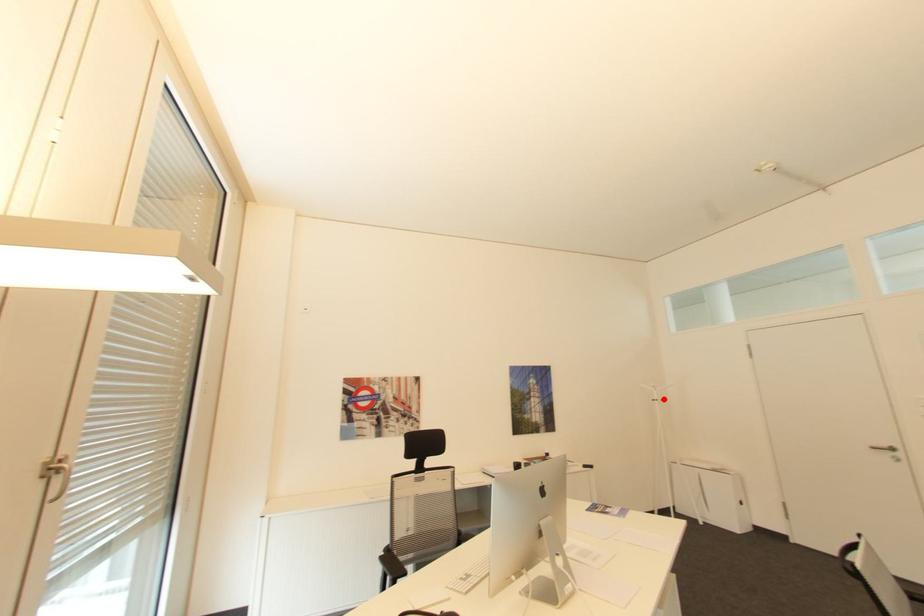
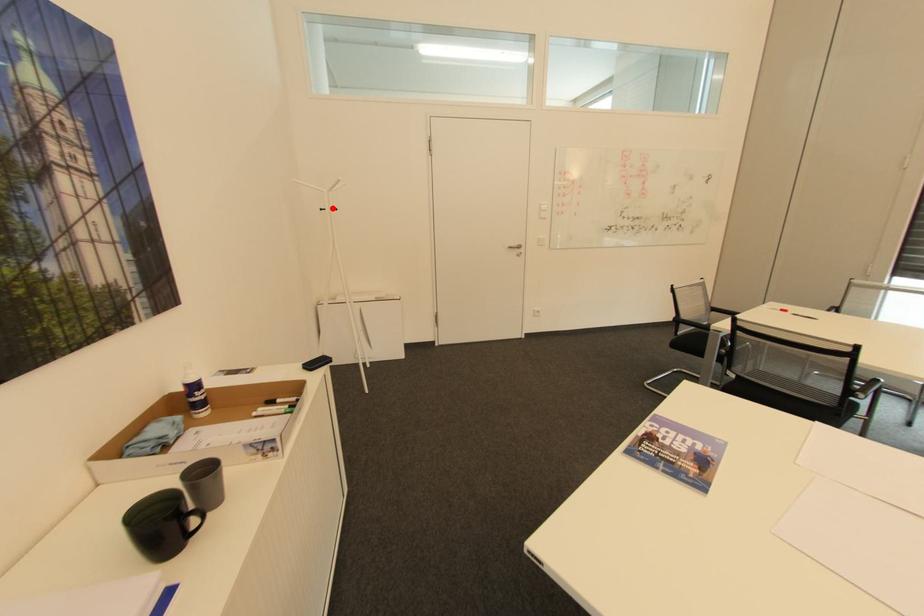
I am providing you with two images of the same scene from different viewpoints. A red point is marked on the first image and another point is marked on the second image. Do the highlighted points in image1 and image2 indicate the same real-world spot?

Yes